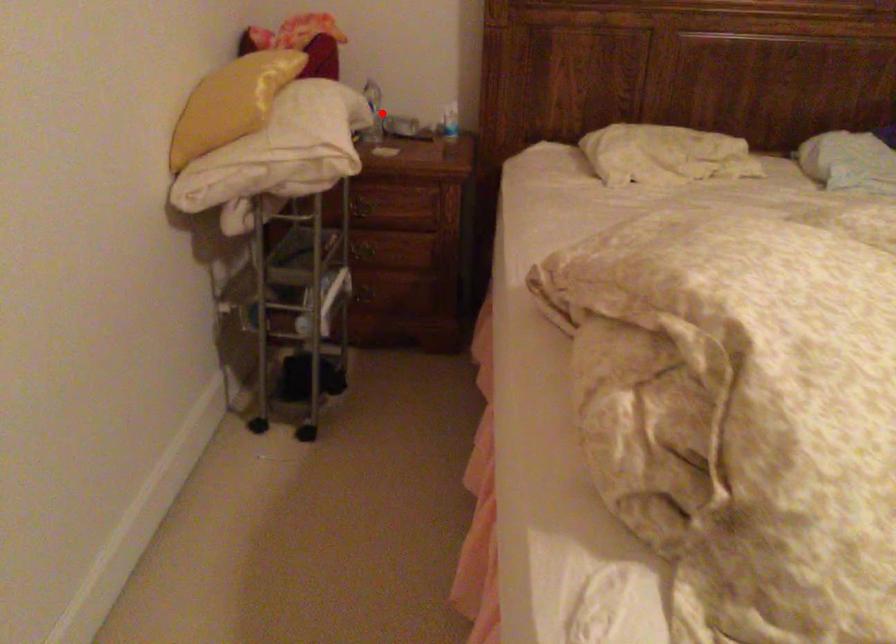
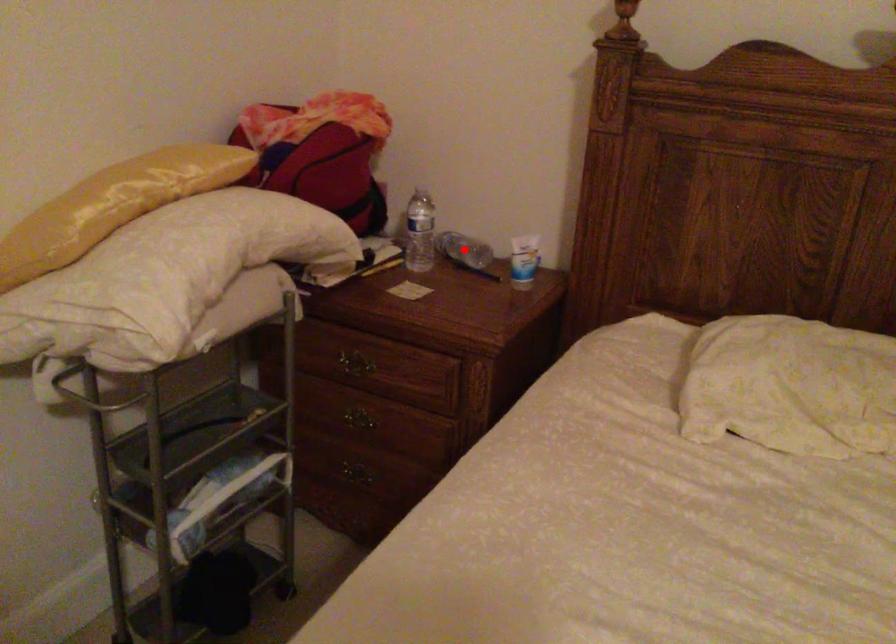
I am providing you with two images of the same scene from different viewpoints. A red point is marked on the first image and another point is marked on the second image. Do the highlighted points in image1 and image2 indicate the same real-world spot?

No